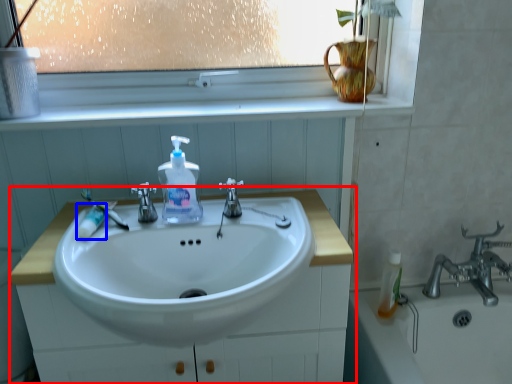
Question: Which object is further to the camera taking this photo, bathroom cabinet (highlighted by a red box) or toothpaste (highlighted by a blue box)?

Choices:
 (A) bathroom cabinet
 (B) toothpaste

Answer: (B)